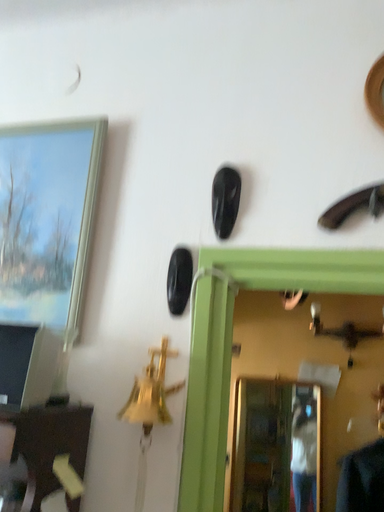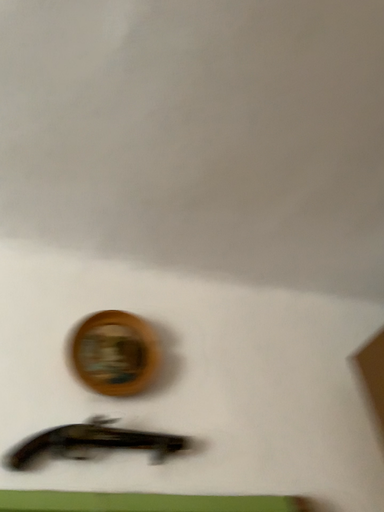
Question: How did the camera likely rotate when shooting the video?

Choices:
 (A) rotated upward
 (B) rotated downward

Answer: (A)